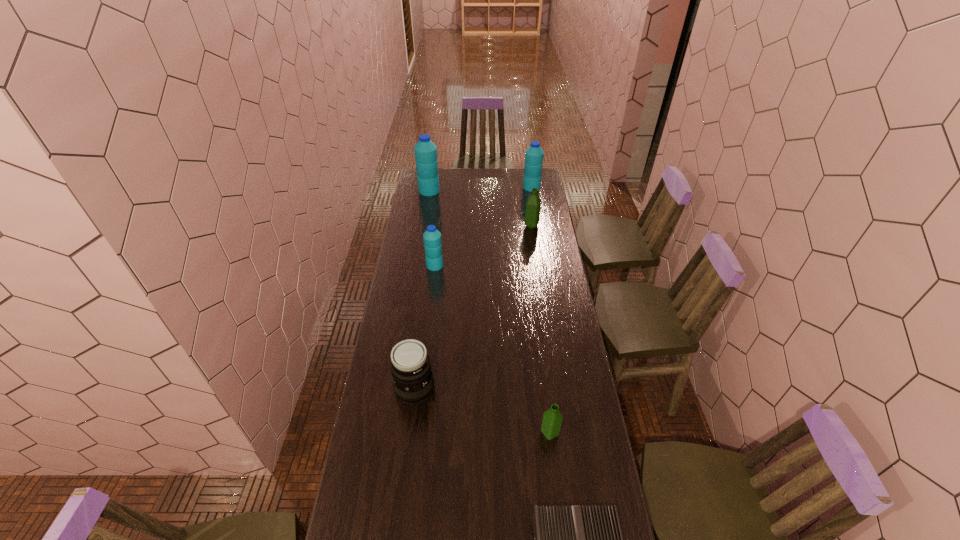
This screenshot has width=960, height=540. Identify the location of vacant area at the left edge of the desktop. (429, 220).

Identify the location of vacant space at the right edge of the desktop. The height and width of the screenshot is (540, 960). click(x=547, y=365).

The height and width of the screenshot is (540, 960). I want to click on empty location between the second biggest blue water bottle and the sixth farthest object, so click(x=540, y=310).

Locate an element on the screen. Image resolution: width=960 pixels, height=540 pixels. vacant area that lies between the fifth farthest object and the second nearest water bottle is located at coordinates (424, 328).

Locate an element on the screen. free spot between the fifth farthest object and the sixth tallest object is located at coordinates (482, 412).

Image resolution: width=960 pixels, height=540 pixels. Find the location of `vacant region between the second tallest water bottle and the fifth farthest object`. vacant region between the second tallest water bottle and the fifth farthest object is located at coordinates (473, 288).

Identify which object is located as the nearest to the rightmost blue water bottle. Please provide its 2D coordinates. Your answer should be formatted as a tuple, i.e. [(x, y)], where the tuple contains the x and y coordinates of a point satisfying the conditions above.

[(533, 205)]

At what (x,y) coordinates should I click in order to perform the action: click on object identified as the closest to the telephoto lens. Please return your answer as a coordinate pair (x, y). The image size is (960, 540). Looking at the image, I should click on (552, 419).

Find the location of a particular element. The image size is (960, 540). the third closest water bottle to the router is located at coordinates (533, 205).

The width and height of the screenshot is (960, 540). Find the location of `water bottle that stands as the fourth closest to the third nearest water bottle`. water bottle that stands as the fourth closest to the third nearest water bottle is located at coordinates (552, 419).